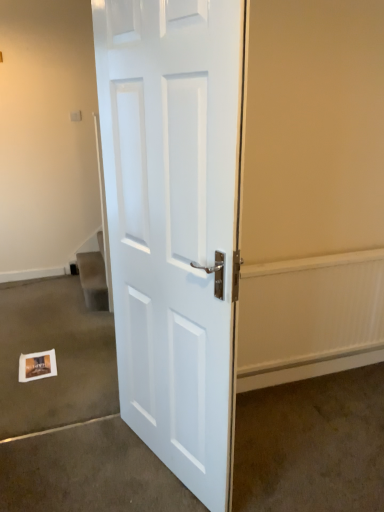
Measure the distance between white glossy door at center and camera.

white glossy door at center and camera are 1.04 meters apart from each other.

Describe the element at coordinates (175, 223) in the screenshot. The image size is (384, 512). I see `white glossy door at center` at that location.

The height and width of the screenshot is (512, 384). Describe the element at coordinates (56, 357) in the screenshot. I see `white paper at lower left, the 2th concrete viewed from the right` at that location.

Locate an element on the screen. This screenshot has height=512, width=384. white glossy door at center is located at coordinates (175, 223).

Visually, is white matte postcard at lower left positioned to the left or to the right of white glossy door at center?

Clearly, white matte postcard at lower left is on the left of white glossy door at center in the image.

From the image's perspective, is white matte postcard at lower left above or below white glossy door at center?

Based on their image positions, white matte postcard at lower left is located beneath white glossy door at center.

Is point (22, 360) closer or farther from the camera than point (130, 245)?

Point (22, 360) is farther from the camera than point (130, 245).

Locate an element on the screen. door above the white matte postcard at lower left (from the image's perspective) is located at coordinates (175, 223).

Where is `the 2nd concrete below the white glossy door at center (from a real-world perspective)`? The width and height of the screenshot is (384, 512). the 2nd concrete below the white glossy door at center (from a real-world perspective) is located at coordinates (312, 445).

Looking at this image, does white glossy door at center touch matte white door at center, the 1th concrete viewed from the right?

No, white glossy door at center is not touching matte white door at center, the 1th concrete viewed from the right.

Consider the image. From a real-world perspective, is white glossy door at center physically above matte white door at center, marked as the 2th concrete in a left-to-right arrangement?

Yes, from a real-world perspective, white glossy door at center is over matte white door at center, marked as the 2th concrete in a left-to-right arrangement

Would you say white glossy door at center contains matte white door at center, the 1th concrete viewed from the right?

Actually, matte white door at center, the 1th concrete viewed from the right, is outside white glossy door at center.

In the image, there is a matte white door at center, the 1th concrete viewed from the right. In order to click on door above it (from the image's perspective) in this screenshot , I will do `click(175, 223)`.

From the image's perspective, is matte white door at center, the 1th concrete viewed from the right, on white glossy door at center?

No, from the image's perspective, matte white door at center, the 1th concrete viewed from the right, is not over white glossy door at center.

Can you confirm if matte white door at center, the 1th concrete viewed from the right, is bigger than white glossy door at center?

No.

From a real-world perspective, which is physically below, matte white door at center, marked as the 2th concrete in a left-to-right arrangement, or white glossy door at center?

matte white door at center, marked as the 2th concrete in a left-to-right arrangement, from a real-world perspective.

Considering the sizes of objects white matte postcard at lower left and white paper at lower left, the 2th concrete viewed from the right, in the image provided, who is smaller, white matte postcard at lower left or white paper at lower left, the 2th concrete viewed from the right,?

white matte postcard at lower left.

From the picture: Which is more to the right, white matte postcard at lower left or white paper at lower left, the 1th concrete positioned from the left?

Positioned to the right is white matte postcard at lower left.

Are white matte postcard at lower left and white paper at lower left, the 2th concrete viewed from the right, making contact?

No.

How far apart are white matte postcard at lower left and white paper at lower left, the 1th concrete positioned from the left?

The distance of white matte postcard at lower left from white paper at lower left, the 1th concrete positioned from the left, is 13.60 inches.

Can you confirm if matte white door at center, marked as the 2th concrete in a left-to-right arrangement, is positioned to the right of white matte postcard at lower left?

Correct, you'll find matte white door at center, marked as the 2th concrete in a left-to-right arrangement, to the right of white matte postcard at lower left.

Does point (310, 399) come in front of point (53, 369)?

Yes, it is in front of point (53, 369).

Can you tell me how much matte white door at center, the 1th concrete viewed from the right, and white matte postcard at lower left differ in facing direction?

The angular difference between matte white door at center, the 1th concrete viewed from the right, and white matte postcard at lower left is 179 degrees.

Is matte white door at center, marked as the 2th concrete in a left-to-right arrangement, directly adjacent to white matte postcard at lower left?

No, matte white door at center, marked as the 2th concrete in a left-to-right arrangement, is not touching white matte postcard at lower left.

In terms of height, does white paper at lower left, the 1th concrete positioned from the left, look taller or shorter compared to white glossy door at center?

white paper at lower left, the 1th concrete positioned from the left, is shorter than white glossy door at center.

Considering the relative sizes of white paper at lower left, the 2th concrete viewed from the right, and white glossy door at center in the image provided, is white paper at lower left, the 2th concrete viewed from the right, wider than white glossy door at center?

Yes.

Considering the positions of points (69, 399) and (122, 54), is point (69, 399) closer to camera compared to point (122, 54)?

No, (69, 399) is further to viewer.

Considering the positions of objects white paper at lower left, the 2th concrete viewed from the right, and white glossy door at center in the image provided, who is more to the left, white paper at lower left, the 2th concrete viewed from the right, or white glossy door at center?

white paper at lower left, the 2th concrete viewed from the right.

Which of these two, white glossy door at center or white matte postcard at lower left, is thinner?

Thinner between the two is white glossy door at center.

Does white glossy door at center touch white matte postcard at lower left?

No, white glossy door at center is not touching white matte postcard at lower left.

From a real-world perspective, does white glossy door at center stand above white matte postcard at lower left?

Yes.

Where is `postcard that is below the white glossy door at center (from the image's perspective)`? The height and width of the screenshot is (512, 384). postcard that is below the white glossy door at center (from the image's perspective) is located at coordinates (37, 365).

Locate an element on the screen. This screenshot has width=384, height=512. concrete that is the 2nd object directly below the white glossy door at center (from a real-world perspective) is located at coordinates (312, 445).

Estimate the real-world distances between objects in this image. Which object is further from white glossy door at center, matte white door at center, the 1th concrete viewed from the right, or white matte postcard at lower left?

The object further to white glossy door at center is white matte postcard at lower left.

Considering their positions, is white glossy door at center positioned further to white paper at lower left, the 2th concrete viewed from the right, than matte white door at center, marked as the 2th concrete in a left-to-right arrangement?

white glossy door at center is positioned further to the anchor white paper at lower left, the 2th concrete viewed from the right.

Looking at this image, looking at the image, which one is located closer to white matte postcard at lower left, white paper at lower left, the 1th concrete positioned from the left, or matte white door at center, marked as the 2th concrete in a left-to-right arrangement?

The object closer to white matte postcard at lower left is white paper at lower left, the 1th concrete positioned from the left.

From the picture: Which object lies further to the anchor point white glossy door at center, white paper at lower left, the 2th concrete viewed from the right, or matte white door at center, marked as the 2th concrete in a left-to-right arrangement?

white paper at lower left, the 2th concrete viewed from the right, is further to white glossy door at center.

When comparing their distances from white glossy door at center, does matte white door at center, the 1th concrete viewed from the right, or white paper at lower left, the 2th concrete viewed from the right, seem closer?

matte white door at center, the 1th concrete viewed from the right.

Looking at this image, considering their positions, is white matte postcard at lower left positioned further to matte white door at center, marked as the 2th concrete in a left-to-right arrangement, than white paper at lower left, the 2th concrete viewed from the right?

white matte postcard at lower left is positioned further to the anchor matte white door at center, marked as the 2th concrete in a left-to-right arrangement.

From the image, which object appears to be nearer to white matte postcard at lower left, white glossy door at center or matte white door at center, the 1th concrete viewed from the right?

matte white door at center, the 1th concrete viewed from the right.

Based on the photo, looking at the image, which one is located further to matte white door at center, marked as the 2th concrete in a left-to-right arrangement, white matte postcard at lower left or white glossy door at center?

Based on the image, white matte postcard at lower left appears to be further to matte white door at center, marked as the 2th concrete in a left-to-right arrangement.

Identify the location of door between white paper at lower left, the 1th concrete positioned from the left, and matte white door at center, marked as the 2th concrete in a left-to-right arrangement. 175,223.

The width and height of the screenshot is (384, 512). Identify the location of postcard between white paper at lower left, the 2th concrete viewed from the right, and matte white door at center, marked as the 2th concrete in a left-to-right arrangement, in the horizontal direction. (37, 365).